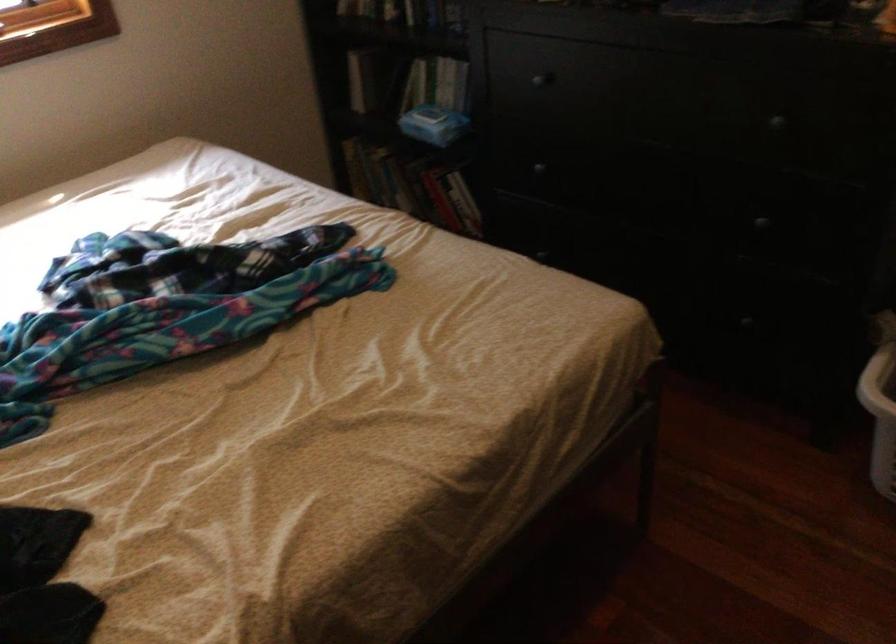
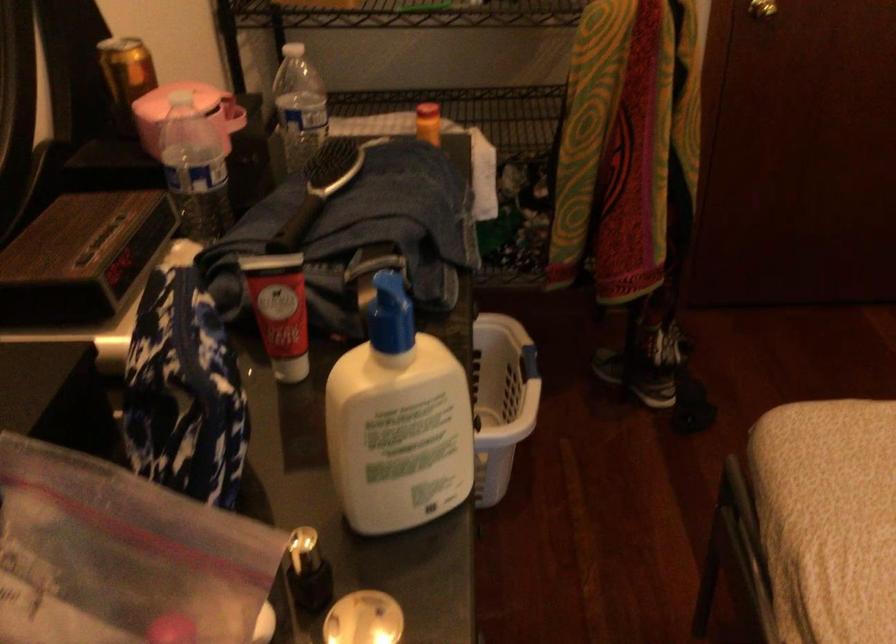
Question: I am providing you with two images of the same scene from different viewpoints. Which of the following objects are not visible in image2?

Choices:
 (A) brass door knob
 (B) pink chalk piece
 (C) laundry basket handle
 (D) black drawer knob

Answer: (D)